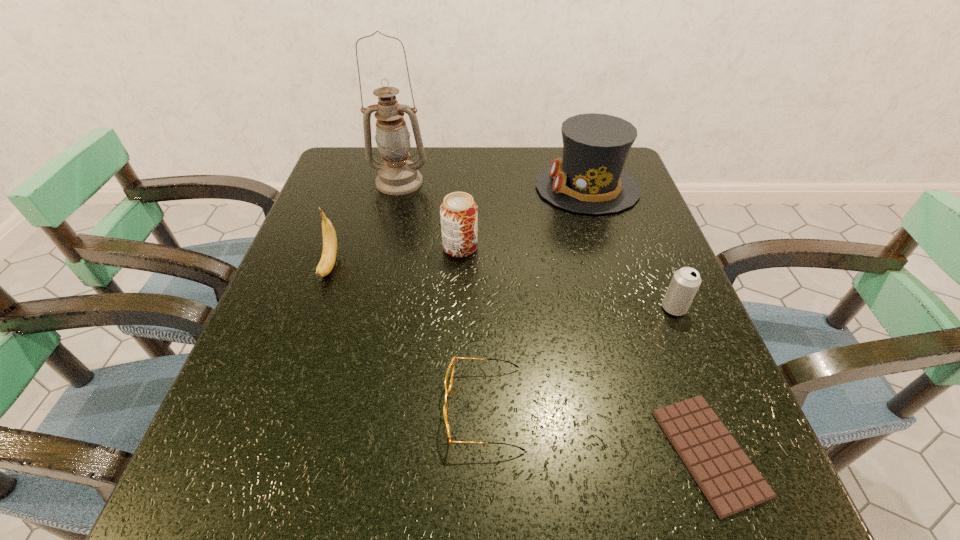
I want to click on object that is at the far right corner, so click(589, 179).

Where is `object that is at the near right corner`? This screenshot has height=540, width=960. object that is at the near right corner is located at coordinates (731, 483).

Locate an element on the screen. vacant position at the far edge of the desktop is located at coordinates (504, 181).

The width and height of the screenshot is (960, 540). Find the location of `vacant space at the near edge of the desktop`. vacant space at the near edge of the desktop is located at coordinates (522, 524).

Where is `vacant space at the left edge of the desktop`? The width and height of the screenshot is (960, 540). vacant space at the left edge of the desktop is located at coordinates (280, 409).

You are a GUI agent. You are given a task and a screenshot of the screen. Output one action in this format:
    pyautogui.click(x=<x>, y=<y>)
    Task: Click on the vacant space at the right edge of the desktop
    
    Given the screenshot: What is the action you would take?
    pyautogui.click(x=646, y=254)

This screenshot has height=540, width=960. What are the coordinates of `blank space at the far left corner of the desktop` in the screenshot? It's located at (363, 151).

The image size is (960, 540). I want to click on free space between the second shortest object and the leftmost object, so click(x=407, y=336).

Locate an element on the screen. The width and height of the screenshot is (960, 540). vacant region between the fifth tallest object and the second shortest object is located at coordinates (579, 358).

At what (x,y) coordinates should I click in order to perform the action: click on unoccupied position between the taller beer can and the chocolate bar. Please return your answer as a coordinate pair (x, y). This screenshot has width=960, height=540. Looking at the image, I should click on (585, 350).